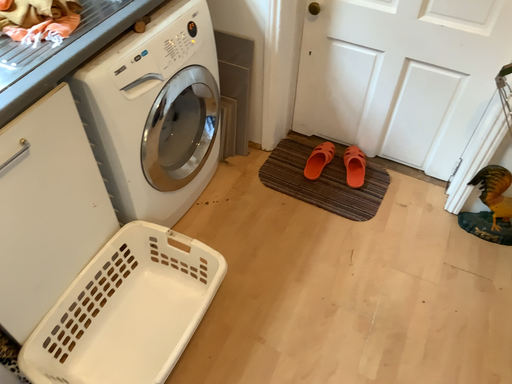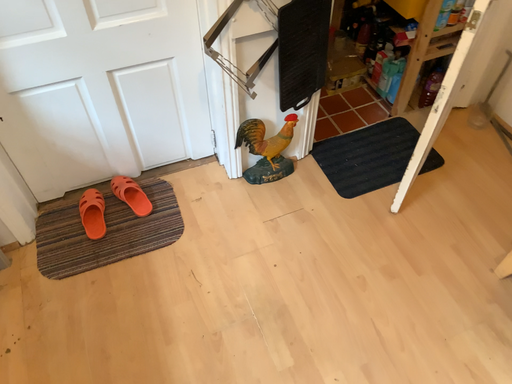
Question: Which way did the camera rotate in the video?

Choices:
 (A) rotated right
 (B) rotated left

Answer: (A)